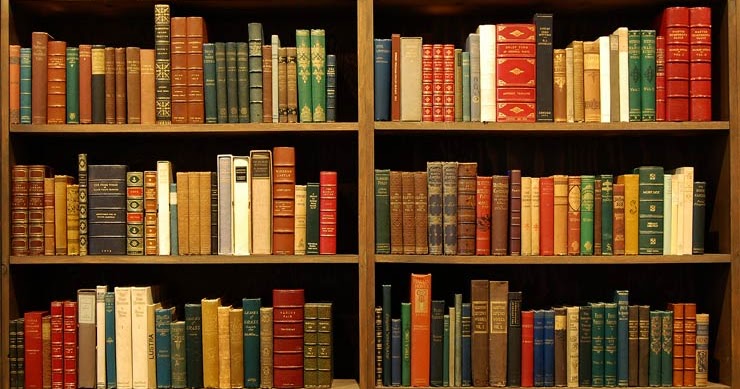
Identify the location of shelves below books. (215, 125), (525, 126), (536, 256), (171, 258).